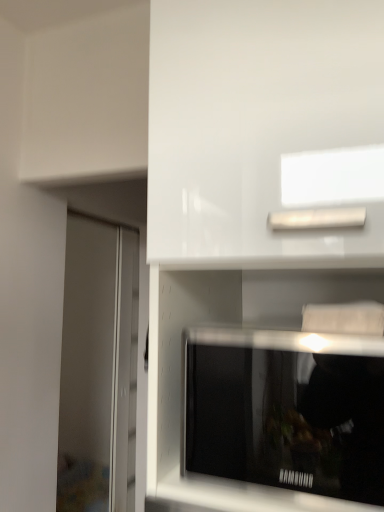
You are a GUI agent. You are given a task and a screenshot of the screen. Output one action in this format:
    pyautogui.click(x=<x>, y=<y>)
    Task: Click on the black glossy microwave oven at center
    This screenshot has width=384, height=512.
    Given the screenshot: What is the action you would take?
    pyautogui.click(x=286, y=411)

What do you see at coordinates (286, 411) in the screenshot? The image size is (384, 512). I see `black glossy microwave oven at center` at bounding box center [286, 411].

Locate an element on the screen. black glossy microwave oven at center is located at coordinates (286, 411).